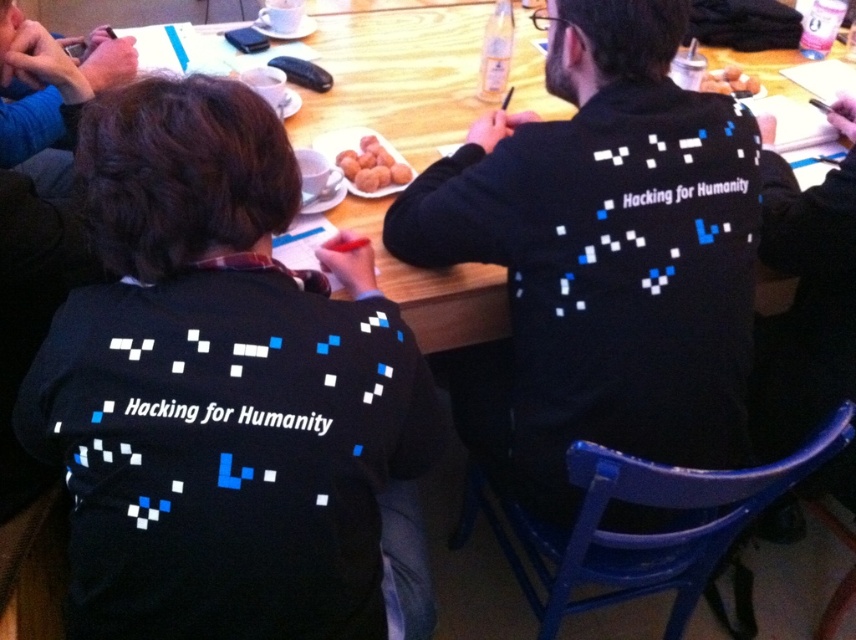
Does black matte shirt at center lie in front of brown crumbly doughnuts at center?

Yes, it is.

Based on the photo, can you confirm if black matte shirt at center is positioned above brown crumbly doughnuts at center?

No.

Is point (235, 406) farther from camera compared to point (738, 67)?

No, (235, 406) is in front of (738, 67).

What are the coordinates of `black matte shirt at center` in the screenshot? It's located at (227, 394).

Is black matte sweater at center below brown matte balls at center?

Correct, black matte sweater at center is located below brown matte balls at center.

Is black matte sweater at center taller than brown matte balls at center?

Indeed, black matte sweater at center has a greater height compared to brown matte balls at center.

Image resolution: width=856 pixels, height=640 pixels. I want to click on black matte sweater at center, so click(599, 259).

Find the location of a particular element. Image resolution: width=856 pixels, height=640 pixels. black matte sweater at center is located at coordinates (599, 259).

Image resolution: width=856 pixels, height=640 pixels. Describe the element at coordinates (397, 74) in the screenshot. I see `wooden table at center` at that location.

Measure the distance between wooden table at center and brown matte balls at center.

A distance of 8.47 inches exists between wooden table at center and brown matte balls at center.

What do you see at coordinates (397, 74) in the screenshot?
I see `wooden table at center` at bounding box center [397, 74].

Where is `wooden table at center`? wooden table at center is located at coordinates (397, 74).